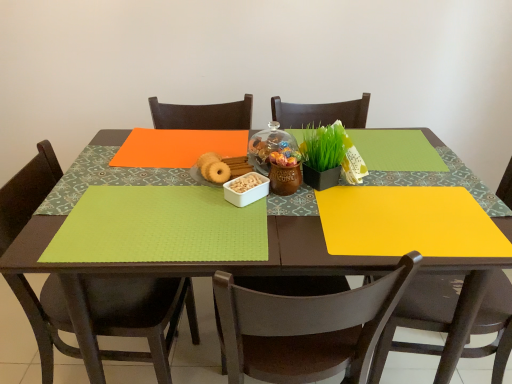
Where is `space that is in front of green matte plant at center`? The height and width of the screenshot is (384, 512). space that is in front of green matte plant at center is located at coordinates (303, 217).